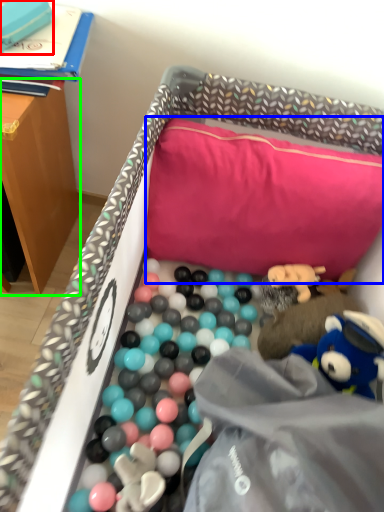
Question: Considering the real-world distances, which object is farthest from toy (highlighted by a red box)? pillow (highlighted by a blue box) or table (highlighted by a green box)?

Choices:
 (A) pillow
 (B) table

Answer: (A)